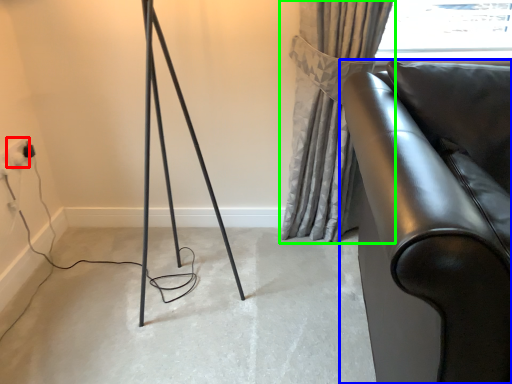
Question: Which is farther away from electric outlet (highlighted by a red box)? furniture (highlighted by a blue box) or curtain (highlighted by a green box)?

Choices:
 (A) furniture
 (B) curtain

Answer: (A)